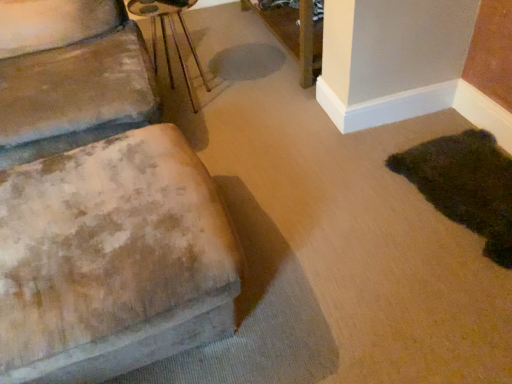
Identify the location of wooden table at upper center. This screenshot has height=384, width=512. (295, 30).

Which is nearer, (318, 29) or (202, 79)?

Point (318, 29).

Locate an element on the screen. The height and width of the screenshot is (384, 512). side table that appears below the wooden table at upper center (from the image's perspective) is located at coordinates (167, 38).

Is wooden table at upper center facing towards metallic silver side table at upper center?

Yes, wooden table at upper center is oriented towards metallic silver side table at upper center.

Considering the positions of objects wooden table at upper center and metallic silver side table at upper center in the image provided, who is more to the left, wooden table at upper center or metallic silver side table at upper center?

Positioned to the left is metallic silver side table at upper center.

Considering the relative sizes of wooden table at upper center and dark green plush rug at lower right in the image provided, is wooden table at upper center thinner than dark green plush rug at lower right?

Yes.

Can you tell me how much wooden table at upper center and dark green plush rug at lower right differ in facing direction?

There is a 0.263-degree angle between the facing directions of wooden table at upper center and dark green plush rug at lower right.

Is wooden table at upper center situated inside dark green plush rug at lower right or outside?

wooden table at upper center is outside dark green plush rug at lower right.

Where is `table on the left of dark green plush rug at lower right`? This screenshot has height=384, width=512. table on the left of dark green plush rug at lower right is located at coordinates (295, 30).

Which is behind, point (0, 42) or point (285, 11)?

Point (285, 11)

Considering the relative positions of worn fabric ottoman at left and wooden table at upper center in the image provided, is worn fabric ottoman at left to the left or to the right of wooden table at upper center?

worn fabric ottoman at left is to the left of wooden table at upper center.

Considering the relative sizes of worn fabric ottoman at left and wooden table at upper center in the image provided, is worn fabric ottoman at left thinner than wooden table at upper center?

No, worn fabric ottoman at left is not thinner than wooden table at upper center.

The height and width of the screenshot is (384, 512). Find the location of `table on the right of worn fabric ottoman at left`. table on the right of worn fabric ottoman at left is located at coordinates (295, 30).

Does metallic silver side table at upper center appear on the right side of dark green plush rug at lower right?

No, metallic silver side table at upper center is not to the right of dark green plush rug at lower right.

From a real-world perspective, is metallic silver side table at upper center physically above dark green plush rug at lower right?

Yes, from a real-world perspective, metallic silver side table at upper center is on top of dark green plush rug at lower right.

Is metallic silver side table at upper center aimed at dark green plush rug at lower right?

No, metallic silver side table at upper center is not turned towards dark green plush rug at lower right.

Is there a large distance between metallic silver side table at upper center and dark green plush rug at lower right?

Absolutely, metallic silver side table at upper center is distant from dark green plush rug at lower right.

From a real-world perspective, which is physically below, dark green plush rug at lower right or wooden table at upper center?

From a 3D spatial view, dark green plush rug at lower right is below.

How different are the orientations of dark green plush rug at lower right and wooden table at upper center in degrees?

There is a 0.263-degree angle between the facing directions of dark green plush rug at lower right and wooden table at upper center.

In the scene shown: Is dark green plush rug at lower right oriented away from wooden table at upper center?

dark green plush rug at lower right is not turned away from wooden table at upper center.

Consider the image. Is dark green plush rug at lower right looking in the opposite direction of worn fabric ottoman at left?

dark green plush rug at lower right is not turned away from worn fabric ottoman at left.

Looking at their sizes, would you say dark green plush rug at lower right is wider or thinner than worn fabric ottoman at left?

Considering their sizes, dark green plush rug at lower right looks slimmer than worn fabric ottoman at left.

From a real-world perspective, is dark green plush rug at lower right above or below worn fabric ottoman at left?

dark green plush rug at lower right is situated lower than worn fabric ottoman at left in the real world.

Would you say dark green plush rug at lower right is inside or outside worn fabric ottoman at left?

dark green plush rug at lower right cannot be found inside worn fabric ottoman at left.

Consider the image. Can you tell me how much wooden table at upper center and worn fabric ottoman at left differ in facing direction?

The angular difference between wooden table at upper center and worn fabric ottoman at left is 179 degrees.

Who is more distant, wooden table at upper center or worn fabric ottoman at left?

wooden table at upper center is more distant.

From the image's perspective, which is above, wooden table at upper center or worn fabric ottoman at left?

From the image's view, wooden table at upper center is above.

Based on their positions, is wooden table at upper center located to the left or right of worn fabric ottoman at left?

In the image, wooden table at upper center appears on the right side of worn fabric ottoman at left.

Identify the location of side table in front of the wooden table at upper center. 167,38.

Where is `table behind the dark green plush rug at lower right`? The image size is (512, 384). table behind the dark green plush rug at lower right is located at coordinates (295, 30).

Considering their positions, is wooden table at upper center positioned closer to dark green plush rug at lower right than worn fabric ottoman at left?

Among the two, worn fabric ottoman at left is located nearer to dark green plush rug at lower right.

Estimate the real-world distances between objects in this image. Which object is closer to wooden table at upper center, dark green plush rug at lower right or metallic silver side table at upper center?

Among the two, metallic silver side table at upper center is located nearer to wooden table at upper center.

From the image, which object appears to be nearer to dark green plush rug at lower right, wooden table at upper center or metallic silver side table at upper center?

wooden table at upper center.

Considering their positions, is wooden table at upper center positioned further to metallic silver side table at upper center than worn fabric ottoman at left?

worn fabric ottoman at left is further to metallic silver side table at upper center.

Based on their spatial positions, is metallic silver side table at upper center or worn fabric ottoman at left closer to wooden table at upper center?

metallic silver side table at upper center is closer to wooden table at upper center.

Based on the photo, which object lies further to the anchor point worn fabric ottoman at left, dark green plush rug at lower right or wooden table at upper center?

wooden table at upper center.

Estimate the real-world distances between objects in this image. Which object is further from worn fabric ottoman at left, wooden table at upper center or dark green plush rug at lower right?

wooden table at upper center.

When comparing their distances from dark green plush rug at lower right, does metallic silver side table at upper center or worn fabric ottoman at left seem further?

metallic silver side table at upper center is further to dark green plush rug at lower right.

This screenshot has width=512, height=384. I want to click on animal located between worn fabric ottoman at left and wooden table at upper center in the depth direction, so click(465, 185).

Where is `side table located between worn fabric ottoman at left and wooden table at upper center in the depth direction`? The width and height of the screenshot is (512, 384). side table located between worn fabric ottoman at left and wooden table at upper center in the depth direction is located at coordinates (167, 38).

The image size is (512, 384). I want to click on side table located between worn fabric ottoman at left and dark green plush rug at lower right in the left-right direction, so click(167, 38).

Locate an element on the screen. table between metallic silver side table at upper center and dark green plush rug at lower right in the horizontal direction is located at coordinates (295, 30).